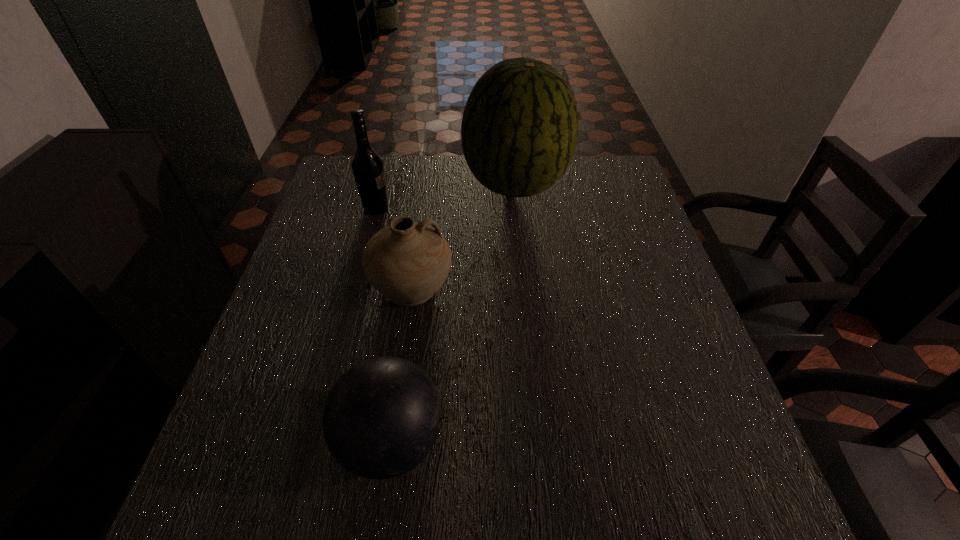
Identify the location of free space that satisfies the following two spatial constraints: 1. on the label of the third farthest object; 2. on the right side of the wine bottle. The image size is (960, 540). (355, 286).

Locate an element on the screen. The image size is (960, 540). vacant space that satisfies the following two spatial constraints: 1. on the back side of the watermelon; 2. on the left side of the third farthest object is located at coordinates (426, 186).